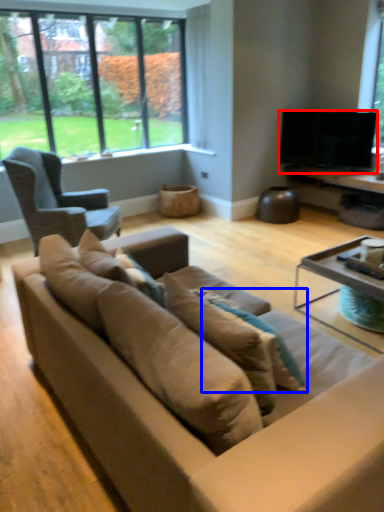
Question: Which object appears farthest to the camera in this image, television (highlighted by a red box) or pillow (highlighted by a blue box)?

Choices:
 (A) television
 (B) pillow

Answer: (A)